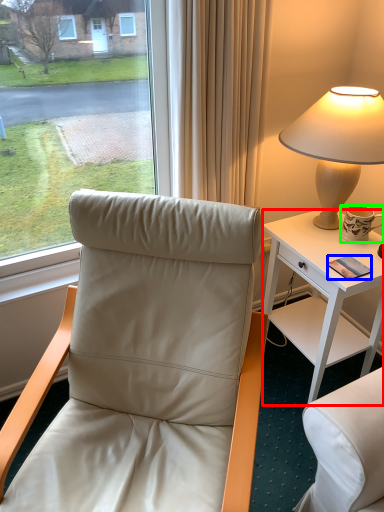
Question: Based on their relative distances, which object is farther from desk (highlighted by a red box)? Choose from mobile phone (highlighted by a blue box) and coffee cup (highlighted by a green box).

Choices:
 (A) mobile phone
 (B) coffee cup

Answer: (A)